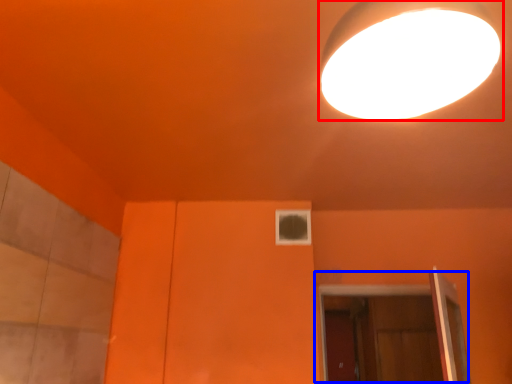
Question: Among these objects, which one is nearest to the camera, lamp (highlighted by a red box) or door (highlighted by a blue box)?

Choices:
 (A) lamp
 (B) door

Answer: (A)